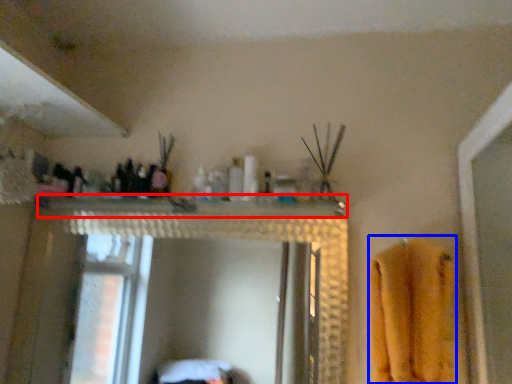
Question: Which object is further to the camera taking this photo, counter top (highlighted by a red box) or bath towel (highlighted by a blue box)?

Choices:
 (A) counter top
 (B) bath towel

Answer: (A)